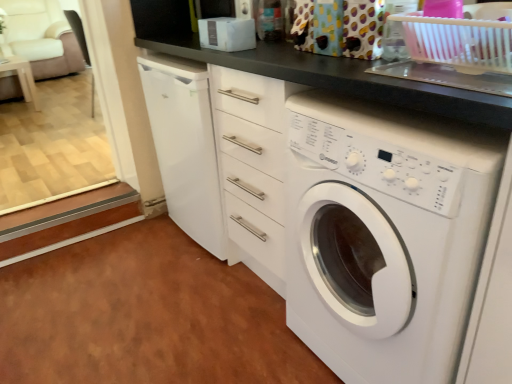
This screenshot has width=512, height=384. Identify the location of free space that is to the left of pink plastic basket at upper right. (374, 72).